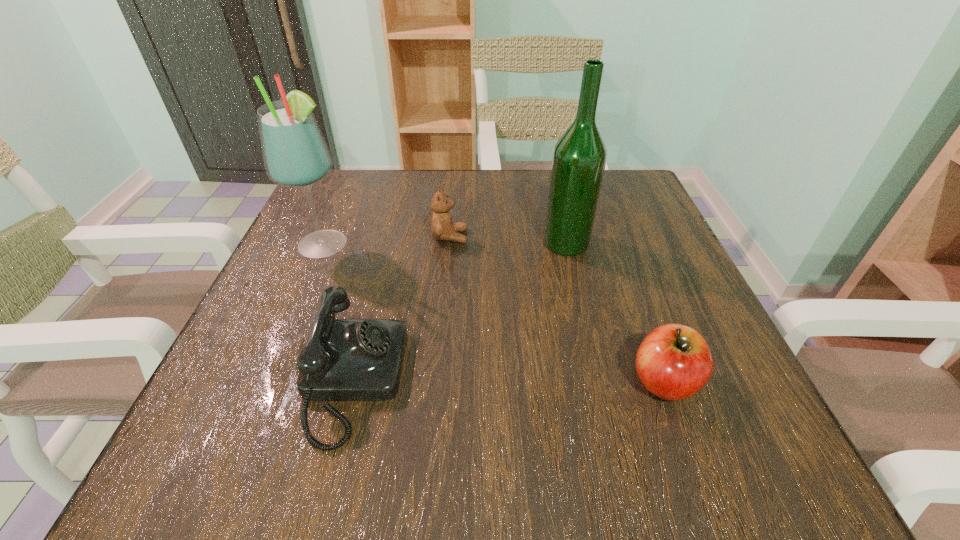
Identify the location of the right alcohol. (579, 157).

Locate an element on the screen. the left alcohol is located at coordinates (295, 153).

Locate an element on the screen. Image resolution: width=960 pixels, height=540 pixels. the third object from left to right is located at coordinates (442, 227).

Find the location of `telephone`. telephone is located at coordinates (343, 359).

The image size is (960, 540). In order to click on apple in this screenshot , I will do `click(674, 362)`.

You are a GUI agent. You are given a task and a screenshot of the screen. Output one action in this format:
    pyautogui.click(x=<x>, y=<y>)
    Task: Click on the vacant space located on the front of the right alcohol
    The width and height of the screenshot is (960, 540).
    Given the screenshot: What is the action you would take?
    coord(601,390)

This screenshot has height=540, width=960. I want to click on free location located 0.070m on the back of the left alcohol, so click(x=340, y=210).

I want to click on vacant space positioned on the face of the teddy bear, so click(x=558, y=237).

In order to click on vacant area situated 0.340m on the dial of the telephone in this screenshot , I will do `click(627, 381)`.

Locate an element on the screen. free space located on the back of the apple is located at coordinates pos(636,308).